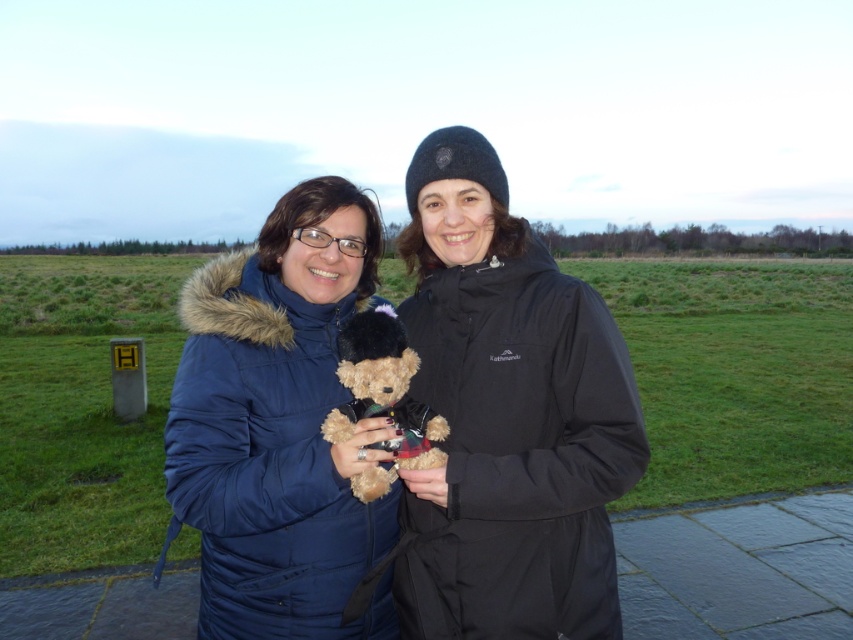
Question: Can you confirm if black softshell jacket at center is smaller than velvet blue coat at center?

Choices:
 (A) no
 (B) yes

Answer: (B)

Question: Which object appears closest to the camera in this image?

Choices:
 (A) fuzzy brown teddy bear at center
 (B) black softshell jacket at center

Answer: (B)

Question: Does velvet blue coat at center appear on the left side of fuzzy brown teddy bear at center?

Choices:
 (A) no
 (B) yes

Answer: (B)

Question: Which object appears farthest from the camera in this image?

Choices:
 (A) black softshell jacket at center
 (B) fuzzy brown teddy bear at center
 (C) velvet blue coat at center

Answer: (B)

Question: Does black softshell jacket at center have a larger size compared to velvet blue coat at center?

Choices:
 (A) yes
 (B) no

Answer: (B)

Question: Estimate the real-world distances between objects in this image. Which object is farther from the velvet blue coat at center?

Choices:
 (A) fuzzy brown teddy bear at center
 (B) black softshell jacket at center

Answer: (B)